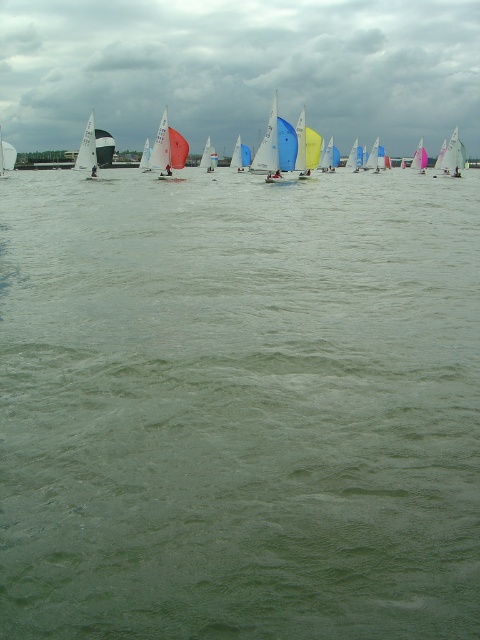
How distant is green water at center from pink sailboat at upper center?

green water at center is 58.36 meters from pink sailboat at upper center.

Can you confirm if green water at center is thinner than pink sailboat at upper center?

No, green water at center is not thinner than pink sailboat at upper center.

Which is in front, point (435, 196) or point (412, 160)?

Point (435, 196)

Locate an element on the screen. green water at center is located at coordinates (239, 408).

From the picture: Measure the distance from green water at center to white matte sailboat at left.

A distance of 78.45 feet exists between green water at center and white matte sailboat at left.

Is green water at center taller than white matte sailboat at left?

Yes.

Who is more distant from viewer, (48, 499) or (92, 120)?

The point (92, 120) is behind.

At what (x,y) coordinates should I click in order to perform the action: click on green water at center. Please return your answer as a coordinate pair (x, y). Image resolution: width=480 pixels, height=640 pixels. Looking at the image, I should click on (239, 408).

Between point (91, 172) and point (421, 145), which one is positioned behind?

Positioned behind is point (421, 145).

Does white matte sailboat at left appear on the left side of pink sailboat at upper center?

Indeed, white matte sailboat at left is positioned on the left side of pink sailboat at upper center.

Who is more forward, (80, 164) or (424, 150)?

Positioned in front is point (80, 164).

You are a GUI agent. You are given a task and a screenshot of the screen. Output one action in this format:
    pyautogui.click(x=<x>, y=<y>)
    Task: Click on the white matte sailboat at left
    The width and height of the screenshot is (480, 640).
    Given the screenshot: What is the action you would take?
    click(x=86, y=148)